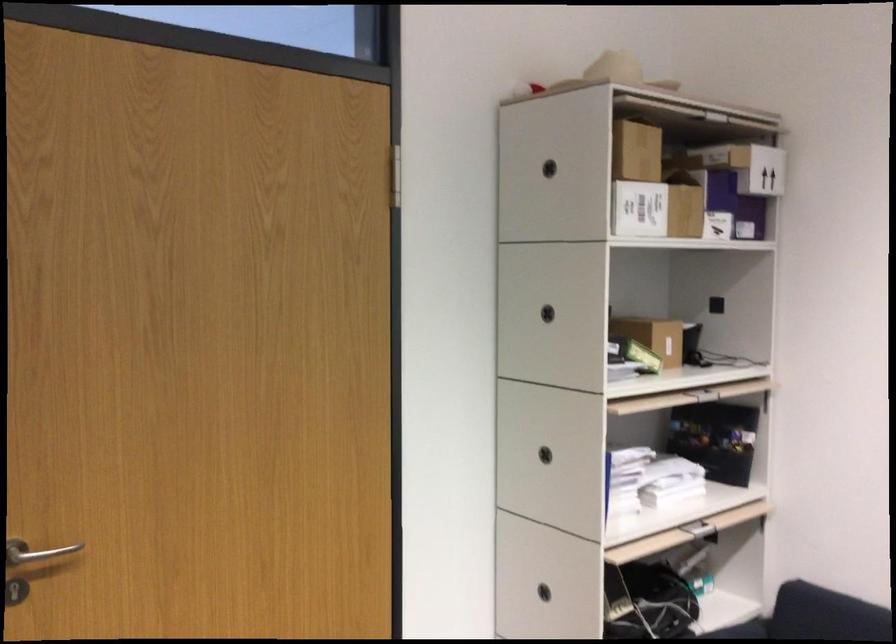
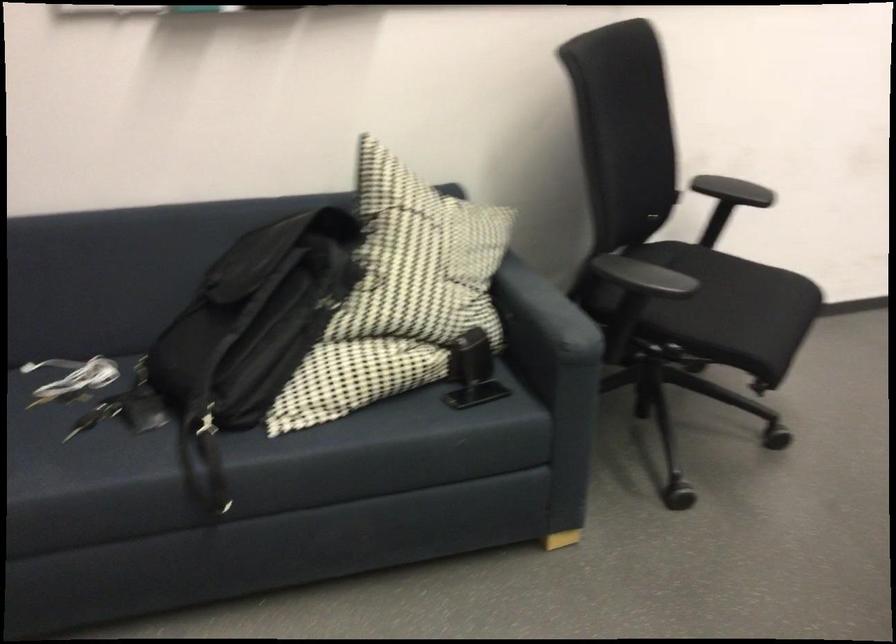
Based on the continuous images, in which direction is the camera rotating?

The camera rotated toward right-down.